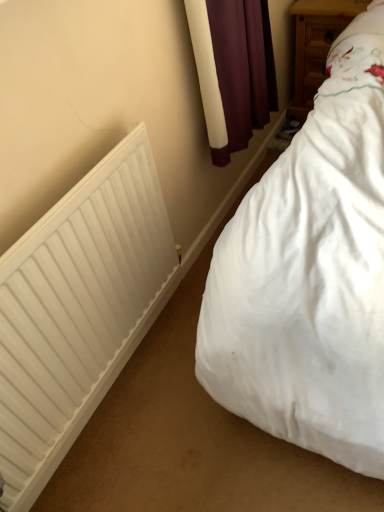
Question: Can you confirm if white matte radiator at left is wider than white wood nightstand at upper right?

Choices:
 (A) yes
 (B) no

Answer: (B)

Question: From a real-world perspective, is white matte radiator at left physically below white wood nightstand at upper right?

Choices:
 (A) no
 (B) yes

Answer: (A)

Question: Is white matte radiator at left behind white wood nightstand at upper right?

Choices:
 (A) no
 (B) yes

Answer: (A)

Question: Are white matte radiator at left and white wood nightstand at upper right beside each other?

Choices:
 (A) yes
 (B) no

Answer: (B)

Question: Can you confirm if white matte radiator at left is shorter than white wood nightstand at upper right?

Choices:
 (A) yes
 (B) no

Answer: (B)

Question: Can you confirm if white matte radiator at left is smaller than white wood nightstand at upper right?

Choices:
 (A) no
 (B) yes

Answer: (B)

Question: Is white wood nightstand at upper right facing towards white matte radiator at left?

Choices:
 (A) yes
 (B) no

Answer: (A)

Question: Is white wood nightstand at upper right located outside white matte radiator at left?

Choices:
 (A) no
 (B) yes

Answer: (B)

Question: Considering the relative sizes of white wood nightstand at upper right and white matte radiator at left in the image provided, is white wood nightstand at upper right smaller than white matte radiator at left?

Choices:
 (A) no
 (B) yes

Answer: (A)

Question: From the image's perspective, is white wood nightstand at upper right located above white matte radiator at left?

Choices:
 (A) no
 (B) yes

Answer: (B)

Question: Is white wood nightstand at upper right shorter than white matte radiator at left?

Choices:
 (A) no
 (B) yes

Answer: (B)

Question: Is white wood nightstand at upper right looking in the opposite direction of white matte radiator at left?

Choices:
 (A) no
 (B) yes

Answer: (A)

Question: Is white matte radiator at left taller or shorter than white wood nightstand at upper right?

Choices:
 (A) tall
 (B) short

Answer: (A)